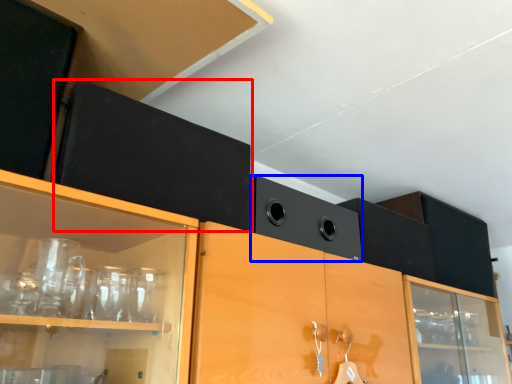
Question: Which object is closer to the camera taking this photo, cabinetry (highlighted by a red box) or speaker (highlighted by a blue box)?

Choices:
 (A) cabinetry
 (B) speaker

Answer: (A)